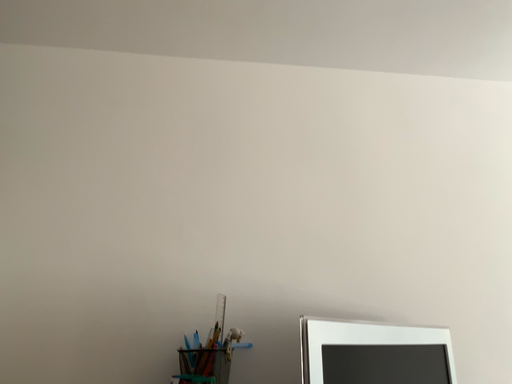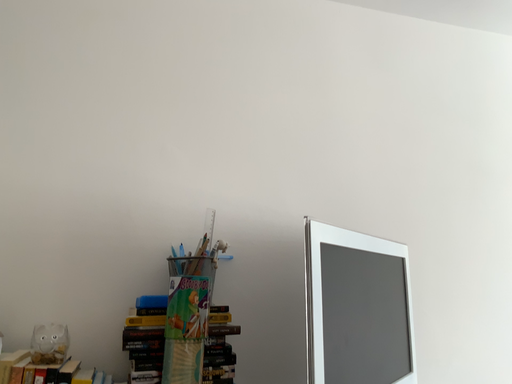
Question: How did the camera likely rotate when shooting the video?

Choices:
 (A) rotated upward
 (B) rotated downward

Answer: (B)